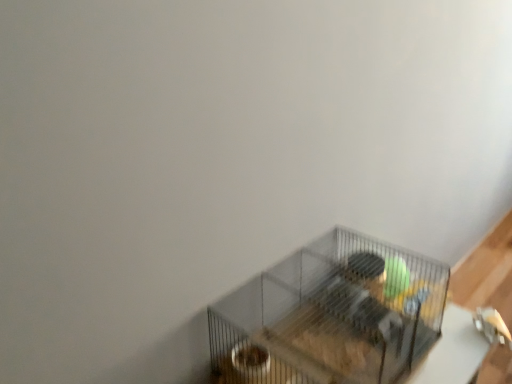
This screenshot has height=384, width=512. What are the coordinates of `metallic wire birdcage at lower center` in the screenshot? It's located at (334, 313).

What do you see at coordinates (334, 313) in the screenshot? I see `metallic wire birdcage at lower center` at bounding box center [334, 313].

Find the location of a particular element. Image resolution: width=512 pixels, height=384 pixels. metallic wire birdcage at lower center is located at coordinates (334, 313).